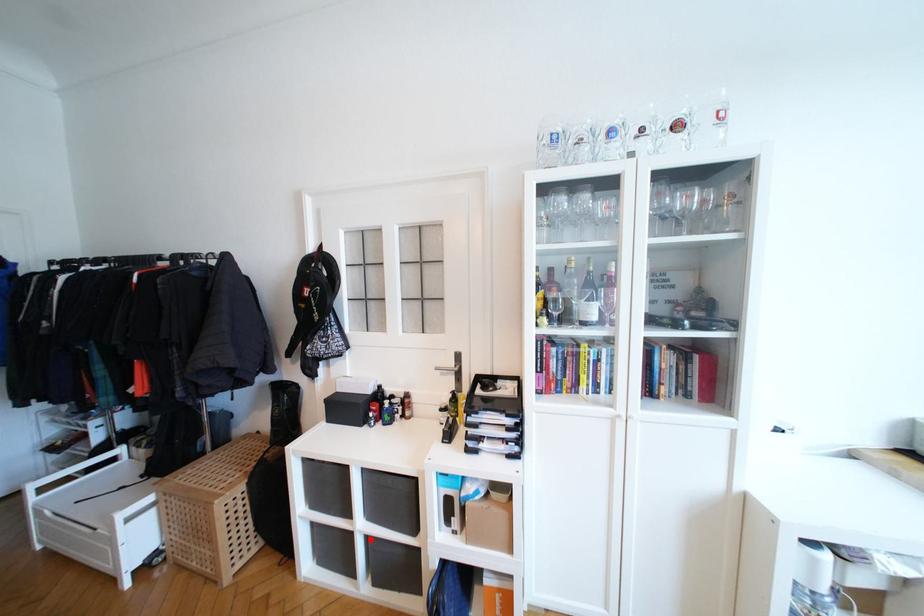
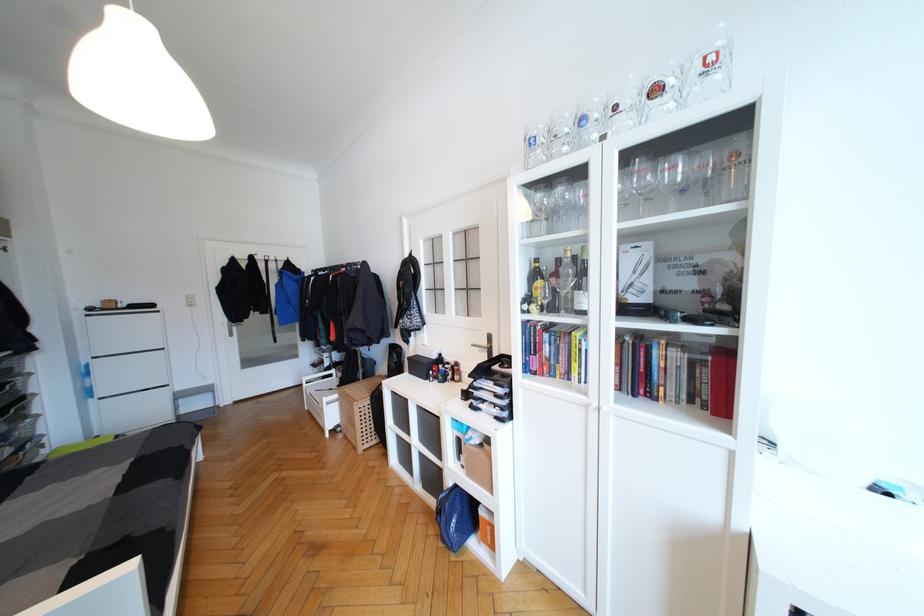
Question: A red point is marked in image1. In image2, is the corresponding 3D point closer to the camera or farther? Reply with the corresponding letter.

Choices:
 (A) The corresponding 3D point is closer.
 (B) The corresponding 3D point is farther.

Answer: (B)